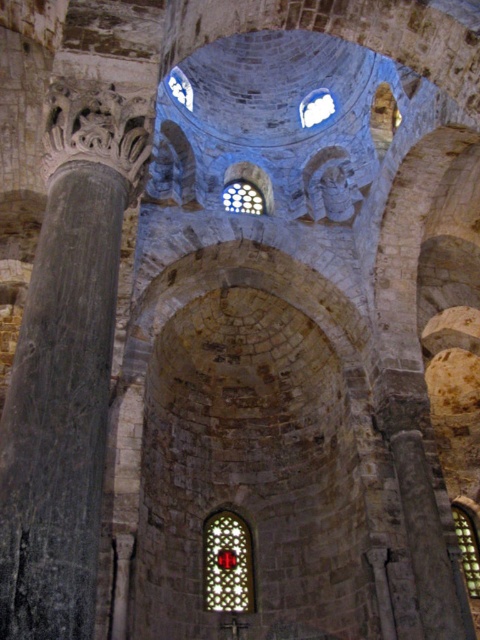
Who is more forward, (217, 550) or (457, 513)?

Positioned in front is point (217, 550).

Identify the location of stained glass window at center. (228, 563).

Can you confirm if clear glass window at lower right is shorter than clear glass window at center?

In fact, clear glass window at lower right may be taller than clear glass window at center.

Which is behind, point (458, 540) or point (257, 202)?

Point (257, 202)

Locate an element on the screen. clear glass window at lower right is located at coordinates (468, 548).

Can you confirm if clear glass window at lower right is thinner than clear glass window at upper center?

No, clear glass window at lower right is not thinner than clear glass window at upper center.

Can you confirm if clear glass window at lower right is positioned below clear glass window at upper center?

Yes.

I want to click on clear glass window at lower right, so click(468, 548).

Find the location of a particular element. The width and height of the screenshot is (480, 640). clear glass window at lower right is located at coordinates pos(468,548).